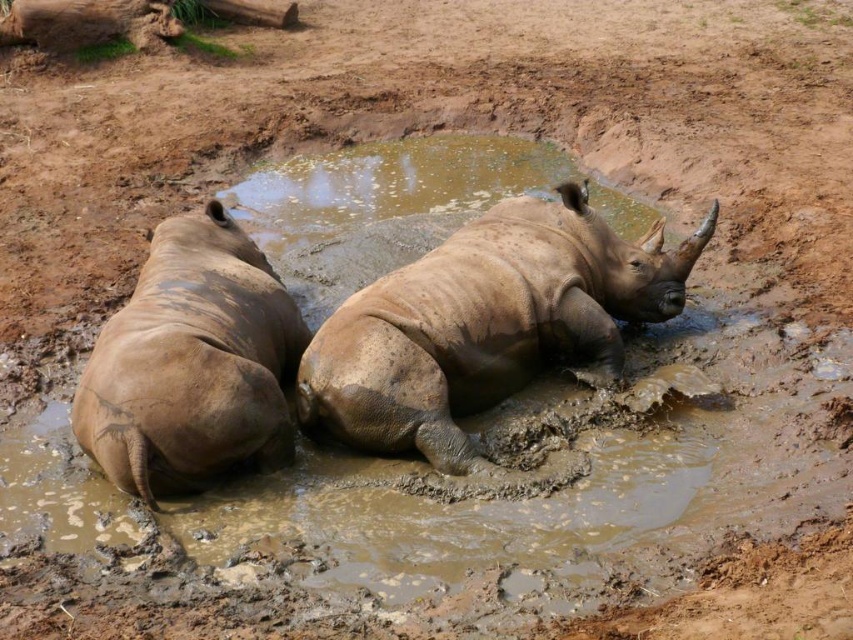
Question: Can you confirm if muddy skin rhino at center is positioned below muddy skin rhino at left?

Choices:
 (A) no
 (B) yes

Answer: (A)

Question: Can you confirm if muddy skin rhino at center is positioned below muddy skin rhino at left?

Choices:
 (A) yes
 (B) no

Answer: (B)

Question: Does muddy skin rhino at center appear on the right side of muddy skin rhino at left?

Choices:
 (A) yes
 (B) no

Answer: (A)

Question: Which point appears closest to the camera in this image?

Choices:
 (A) (404, 320)
 (B) (113, 376)

Answer: (B)